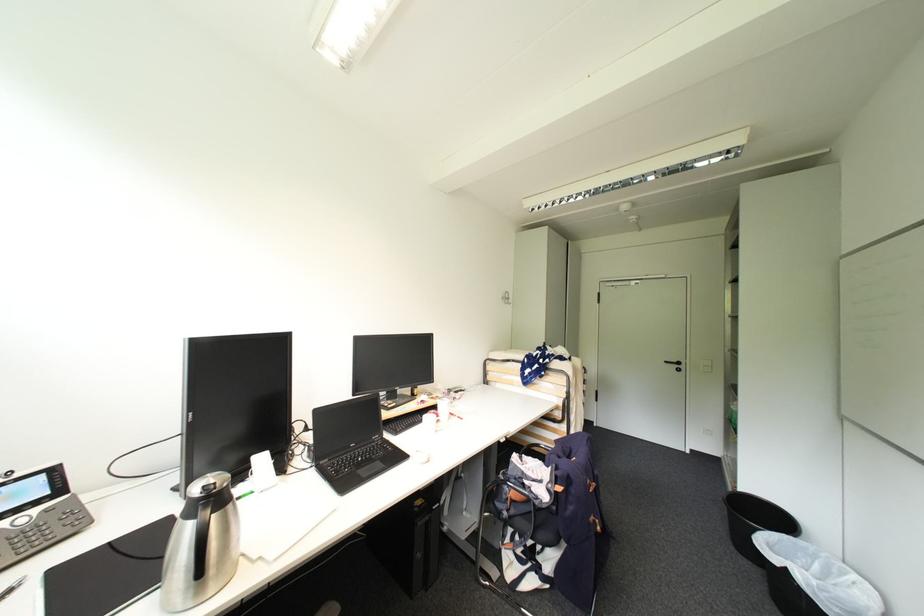
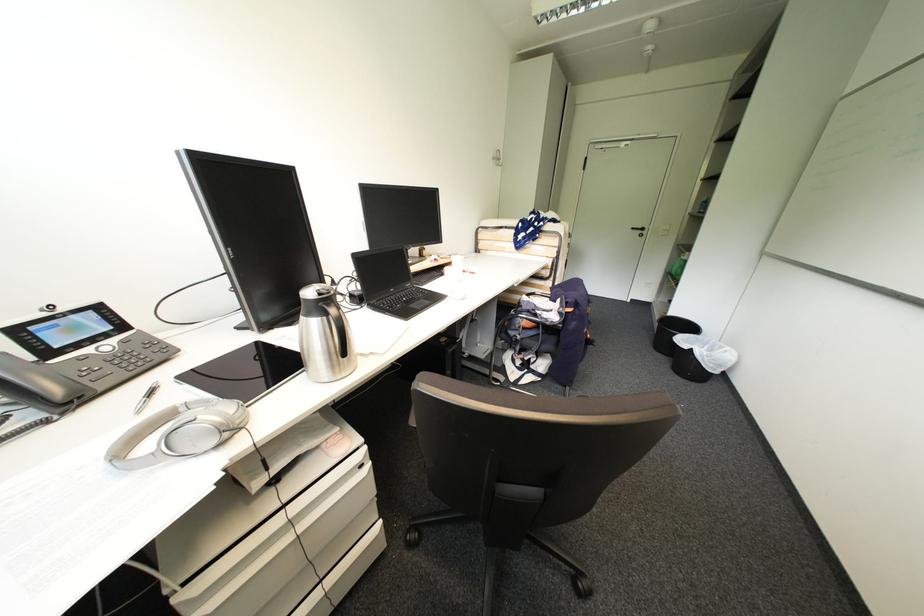
In the second image, find the point that corresponds to pixel 444 406 in the first image.

(456, 262)